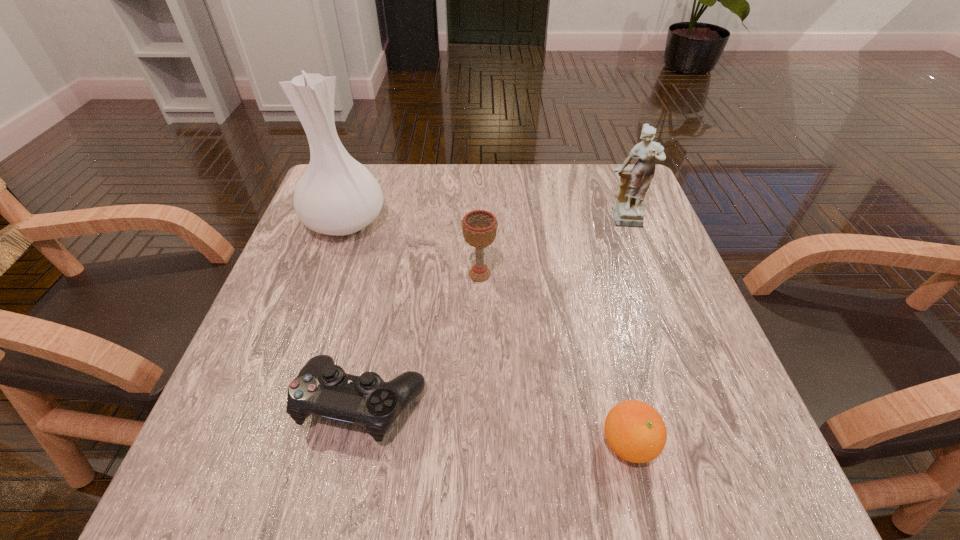
Locate an element on the screen. The height and width of the screenshot is (540, 960). object positioned at the far left corner is located at coordinates (337, 195).

Locate an element on the screen. The width and height of the screenshot is (960, 540). object situated at the near left corner is located at coordinates (321, 388).

You are a GUI agent. You are given a task and a screenshot of the screen. Output one action in this format:
    pyautogui.click(x=<x>, y=<y>)
    Task: Click on the object that is at the far right corner
    This screenshot has width=960, height=540.
    Given the screenshot: What is the action you would take?
    pyautogui.click(x=628, y=211)

The image size is (960, 540). In order to click on object located in the near right corner section of the desktop in this screenshot , I will do `click(635, 431)`.

Where is `free space at the far edge`? This screenshot has height=540, width=960. free space at the far edge is located at coordinates (389, 199).

Where is `vacant space at the near edge`? vacant space at the near edge is located at coordinates (496, 446).

In the image, there is a desktop. At what (x,y) coordinates should I click in order to perform the action: click on vacant space at the left edge. Please return your answer as a coordinate pair (x, y). Image resolution: width=960 pixels, height=540 pixels. Looking at the image, I should click on (269, 397).

In the image, there is a desktop. At what (x,y) coordinates should I click in order to perform the action: click on vacant space at the right edge. Please return your answer as a coordinate pair (x, y). The width and height of the screenshot is (960, 540). Looking at the image, I should click on (589, 233).

At what (x,y) coordinates should I click in order to perform the action: click on blank area at the far left corner. Please return your answer as a coordinate pair (x, y). The height and width of the screenshot is (540, 960). Looking at the image, I should click on (383, 181).

Image resolution: width=960 pixels, height=540 pixels. I want to click on blank space at the near right corner of the desktop, so click(x=746, y=467).